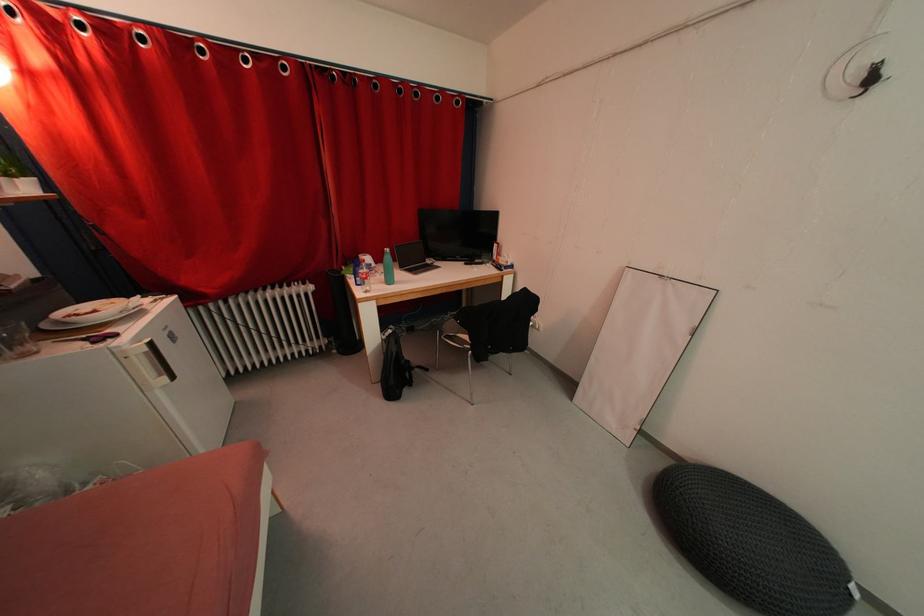
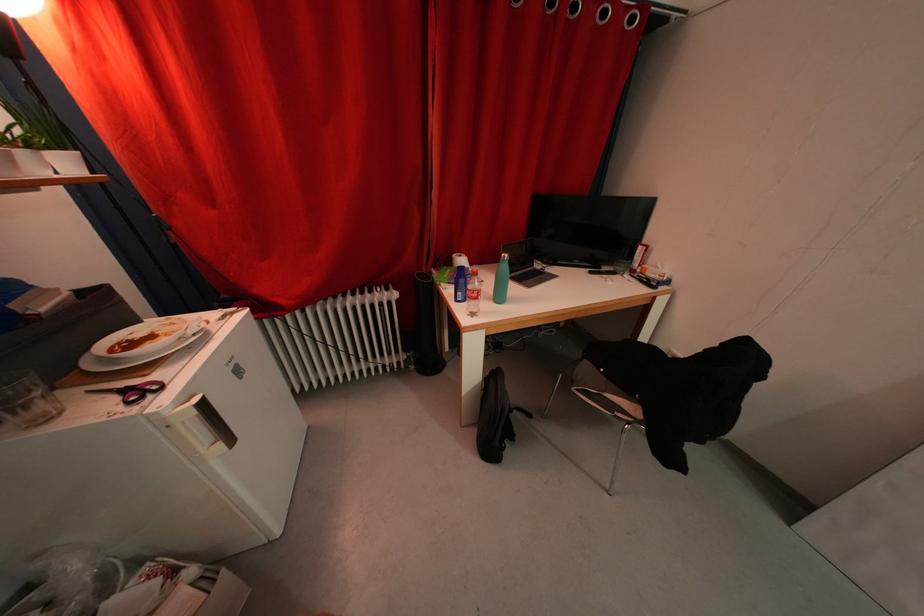
Where in the second image is the point corresponding to point (101, 315) from the first image?

(157, 341)